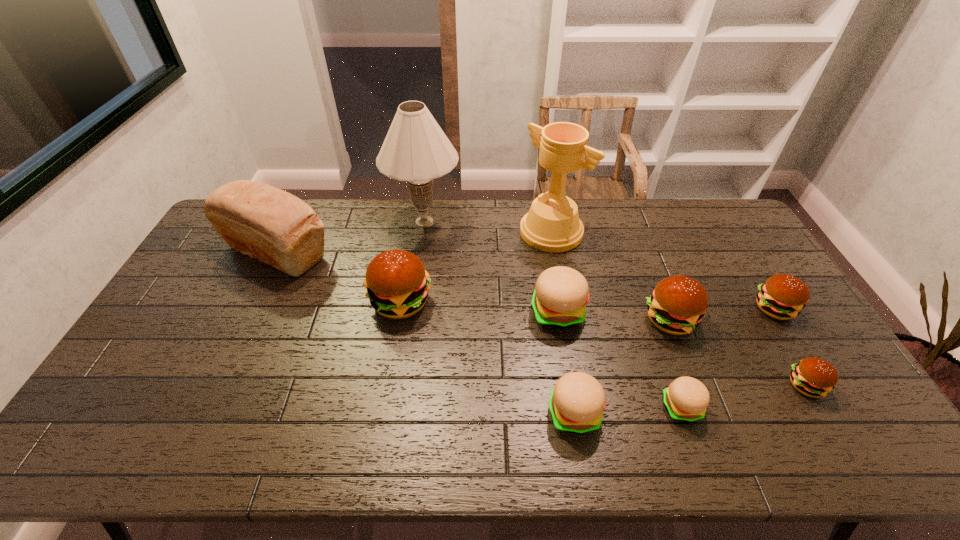
Identify which object is the third closest to the second smallest beige hamburger. Please provide its 2D coordinates. Your answer should be formatted as a tuple, i.e. [(x, y)], where the tuple contains the x and y coordinates of a point satisfying the conditions above.

[(677, 305)]

Choose which hamburger is the second nearest neighbor to the smallest brown hamburger. Please provide its 2D coordinates. Your answer should be formatted as a tuple, i.e. [(x, y)], where the tuple contains the x and y coordinates of a point satisfying the conditions above.

[(677, 305)]

Select which hamburger is the fourth closest to the nearest brown hamburger. Please provide its 2D coordinates. Your answer should be formatted as a tuple, i.e. [(x, y)], where the tuple contains the x and y coordinates of a point satisfying the conditions above.

[(559, 300)]

Select which brown hamburger is the third closest to the smallest brown hamburger. Please provide its 2D coordinates. Your answer should be formatted as a tuple, i.e. [(x, y)], where the tuple contains the x and y coordinates of a point satisfying the conditions above.

[(397, 285)]

Image resolution: width=960 pixels, height=540 pixels. I want to click on brown hamburger that is the third nearest to the beige lampshade, so click(783, 296).

Choose which beige hamburger is the second nearest neighbor to the second smallest beige hamburger. Please provide its 2D coordinates. Your answer should be formatted as a tuple, i.e. [(x, y)], where the tuple contains the x and y coordinates of a point satisfying the conditions above.

[(559, 300)]

The height and width of the screenshot is (540, 960). Find the location of `beige hamburger that is the nearest to the beige lampshade`. beige hamburger that is the nearest to the beige lampshade is located at coordinates pyautogui.click(x=559, y=300).

At what (x,y) coordinates should I click in order to perform the action: click on vacant area in the image that satisfies the following two spatial constraints: 1. on the front side of the beige award; 2. on the left side of the second smallest brown hamburger. Please return your answer as a coordinate pair (x, y). Image resolution: width=960 pixels, height=540 pixels. Looking at the image, I should click on tap(564, 308).